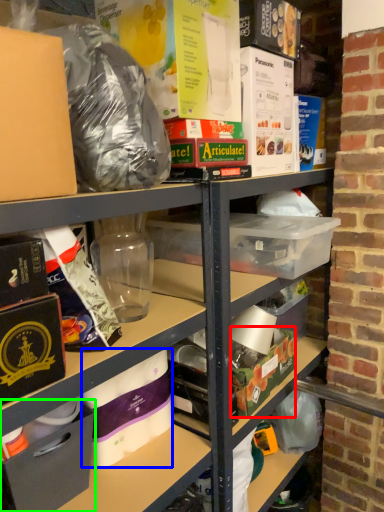
Question: Which object is the closest to the box (highlighted by a red box)? Choose among these: toilet paper (highlighted by a blue box) or box (highlighted by a green box).

Choices:
 (A) toilet paper
 (B) box

Answer: (A)